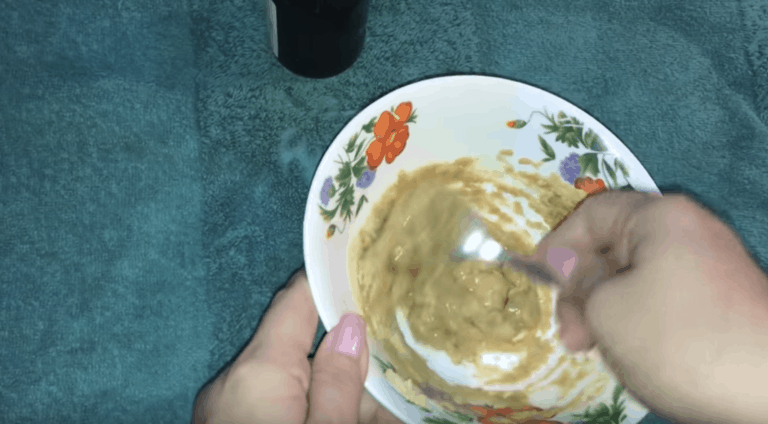
I want to click on floral pattern, so click(x=389, y=135), click(x=594, y=165), click(x=607, y=409).